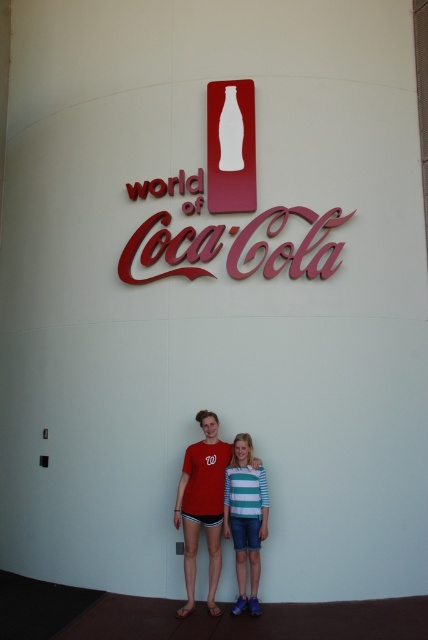
You are standing in front of the World of Coca Cola sign and see two points marked in the image. Which point is closer to you, point (190, 595) or point (243, 474)?

Point (190, 595) is closer to the viewer than point (243, 474).

You are a photographer who wants to capture the two people in the scene. The red cotton t shirt at center is represented by point (202, 506). Where should you position your camera to ensure that the red cotton t shirt at center is centered in the frame?

To center the red cotton t shirt at center, position the camera so that the point (202, 506) is at the center of the frame.